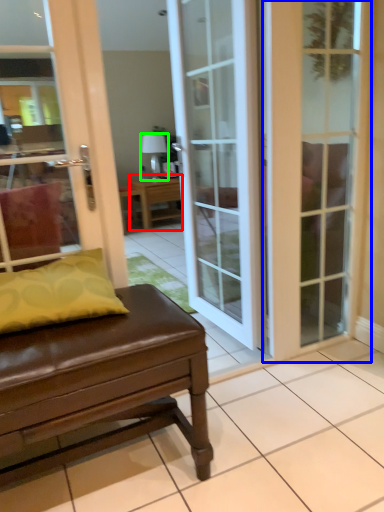
Question: Based on their relative distances, which object is nearer to table (highlighted by a red box)? Choose from door (highlighted by a blue box) and lamp (highlighted by a green box).

Choices:
 (A) door
 (B) lamp

Answer: (B)